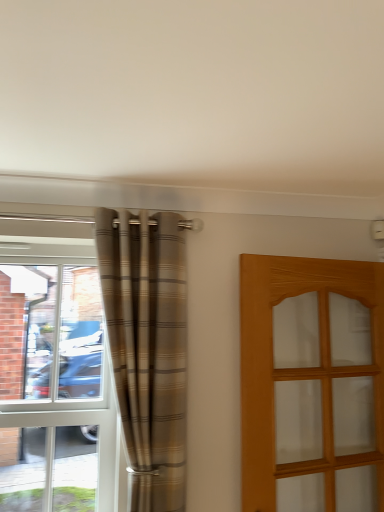
Describe the element at coordinates (55, 375) in the screenshot. I see `clear glass window at left` at that location.

Find the location of a particular element. clear glass window at left is located at coordinates (55, 375).

Based on the photo, could you tell me if clear glass window at left is turned towards plaid fabric curtain at left?

No, clear glass window at left is not aimed at plaid fabric curtain at left.

Is clear glass window at left positioned before plaid fabric curtain at left?

That is False.

Is point (83, 475) positioned after point (153, 433)?

Yes, point (83, 475) is behind point (153, 433).

Would you say clear glass window at left is to the left or to the right of plaid fabric curtain at left in the picture?

clear glass window at left is positioned on plaid fabric curtain at left's left side.

Is light brown wooden door at right facing away from plaid fabric curtain at left?

That's not correct — light brown wooden door at right is not looking away from plaid fabric curtain at left.

Considering the sizes of objects light brown wooden door at right and plaid fabric curtain at left in the image provided, who is wider, light brown wooden door at right or plaid fabric curtain at left?

plaid fabric curtain at left.

Considering the relative positions of light brown wooden door at right and plaid fabric curtain at left in the image provided, is light brown wooden door at right to the left or to the right of plaid fabric curtain at left?

Clearly, light brown wooden door at right is on the right of plaid fabric curtain at left in the image.

From the image's perspective, who appears lower, light brown wooden door at right or plaid fabric curtain at left?

From the image's view, light brown wooden door at right is below.

Considering the sizes of plaid fabric curtain at left and clear glass window at left in the image, is plaid fabric curtain at left bigger or smaller than clear glass window at left?

Considering their sizes, plaid fabric curtain at left takes up more space than clear glass window at left.

Between point (170, 242) and point (27, 301), which one is positioned in front?

Point (170, 242)

Where is `curtain lying on the right of clear glass window at left`? curtain lying on the right of clear glass window at left is located at coordinates (148, 347).

Is plaid fabric curtain at left next to clear glass window at left?

No.

Between clear glass window at left and light brown wooden door at right, which one has less height?

Standing shorter between the two is light brown wooden door at right.

Are clear glass window at left and light brown wooden door at right far apart?

No, there isn't a large distance between clear glass window at left and light brown wooden door at right.

Is plaid fabric curtain at left taller than light brown wooden door at right?

Correct, plaid fabric curtain at left is much taller as light brown wooden door at right.

From a real-world perspective, who is located lower, plaid fabric curtain at left or light brown wooden door at right?

In real-world perspective, light brown wooden door at right is lower.

Which of these two, plaid fabric curtain at left or light brown wooden door at right, is thinner?

Thinner between the two is light brown wooden door at right.

Consider the image. From a real-world perspective, which object rests below the other?

light brown wooden door at right.

Is light brown wooden door at right positioned in front of clear glass window at left?

Yes, light brown wooden door at right is closer to the viewer.

Between light brown wooden door at right and clear glass window at left, which one has larger size?

With larger size is light brown wooden door at right.

Is the surface of light brown wooden door at right in direct contact with clear glass window at left?

There is a gap between light brown wooden door at right and clear glass window at left.

Find the location of a particular element. curtain lying above the clear glass window at left (from the image's perspective) is located at coordinates (148, 347).

Identify the location of door that is in front of the plaid fabric curtain at left. The image size is (384, 512). (312, 384).

Looking at the image, which one is located further to light brown wooden door at right, clear glass window at left or plaid fabric curtain at left?

Among the two, clear glass window at left is located further to light brown wooden door at right.

From the picture: From the image, which object appears to be farther from plaid fabric curtain at left, clear glass window at left or light brown wooden door at right?

light brown wooden door at right lies further to plaid fabric curtain at left than the other object.

Estimate the real-world distances between objects in this image. Which object is closer to clear glass window at left, light brown wooden door at right or plaid fabric curtain at left?

The object closer to clear glass window at left is plaid fabric curtain at left.

Looking at the image, which one is located further to clear glass window at left, plaid fabric curtain at left or light brown wooden door at right?

light brown wooden door at right.

From the image, which object appears to be nearer to plaid fabric curtain at left, light brown wooden door at right or clear glass window at left?

clear glass window at left.

Looking at the image, which one is located further to light brown wooden door at right, plaid fabric curtain at left or clear glass window at left?

clear glass window at left is positioned further to the anchor light brown wooden door at right.

Image resolution: width=384 pixels, height=512 pixels. Identify the location of curtain situated between clear glass window at left and light brown wooden door at right from left to right. (148, 347).